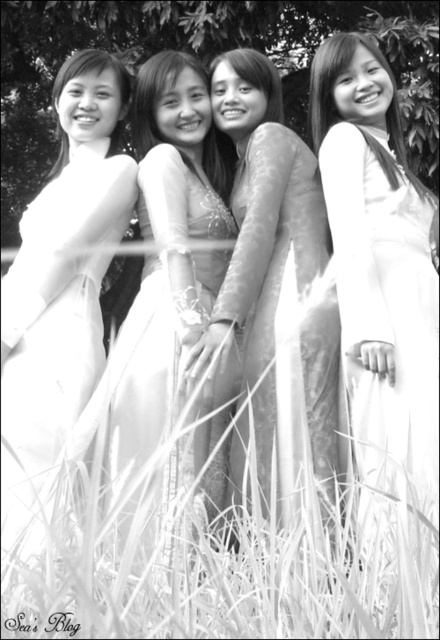
Which is in front, point (371, 467) or point (25, 621)?

Point (25, 621)

Does white silk ao dai at center have a lesser width compared to white soft grass at center?

Yes, white silk ao dai at center is thinner than white soft grass at center.

Between point (418, 333) and point (51, 618), which one is positioned behind?

The point (418, 333) is more distant.

Where is `white silk ao dai at center`? Image resolution: width=440 pixels, height=640 pixels. white silk ao dai at center is located at coordinates (380, 268).

Can you confirm if lace fabric dress at center is shorter than white soft grass at center?

In fact, lace fabric dress at center may be taller than white soft grass at center.

Describe the element at coordinates (275, 292) in the screenshot. I see `lace fabric dress at center` at that location.

At what (x,y) coordinates should I click in order to perform the action: click on lace fabric dress at center. Please return your answer as a coordinate pair (x, y). Looking at the image, I should click on (275, 292).

Does lace fabric dress at center have a greater height compared to white satin ao dai at center?

No, lace fabric dress at center is not taller than white satin ao dai at center.

Is point (201, 349) positioned in front of point (105, 97)?

Yes, point (201, 349) is in front of point (105, 97).

Find the location of a particular element. lace fabric dress at center is located at coordinates (275, 292).